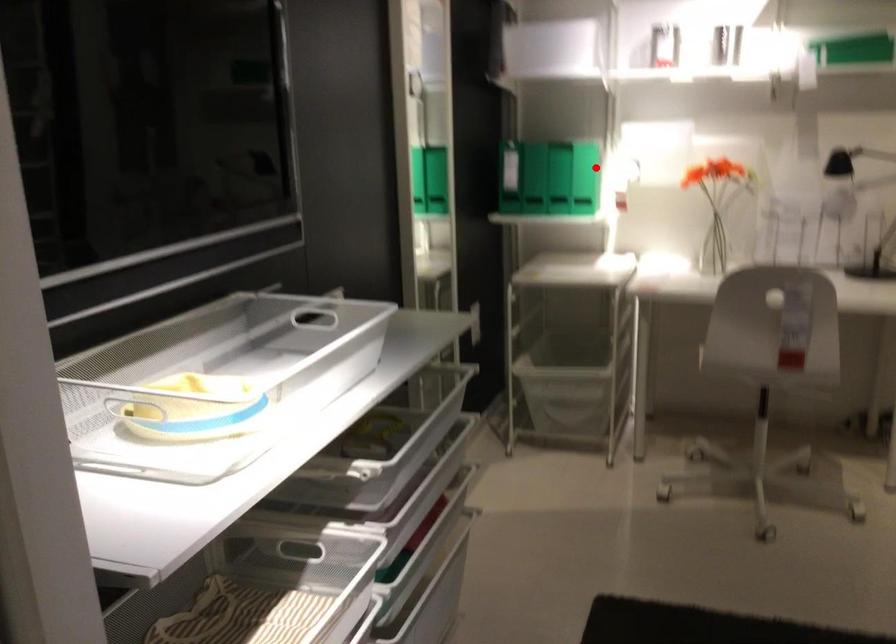
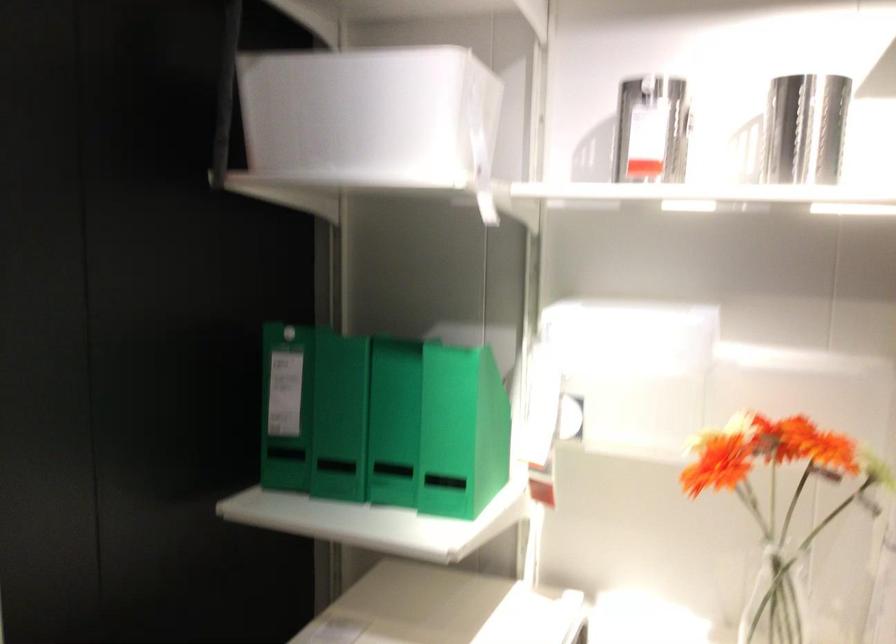
Where in the second image is the point corresponding to the highlighted location from the first image?

(461, 431)